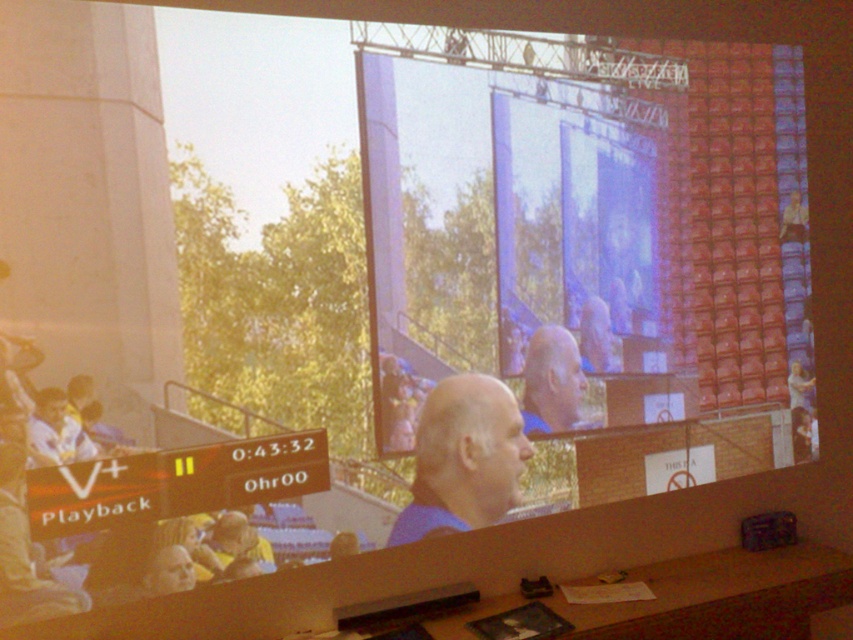
What are the exact coordinates of the blue fabric shirt at center in the image?

The blue fabric shirt at center is located at point (463, 458).

You are a technician adjusting the camera angle to focus on the blue fabric shirt at center and the smooth blue shirt at center. What is the minimum distance the camera needs to move to ensure both shirts are in frame?

The minimum distance the camera needs to move is 7.90 inches to ensure both the blue fabric shirt at center and the smooth blue shirt at center are in frame since they are 7.90 inches apart.

You are a technician checking the projection screen setup. You notice two blue shirts at center in the foreground. Which one is closer to the screen? The blue fabric shirt at center or the smooth blue shirt at center?

The blue fabric shirt at center is closer to the screen because it is located below the smooth blue shirt at center, indicating it is in front.